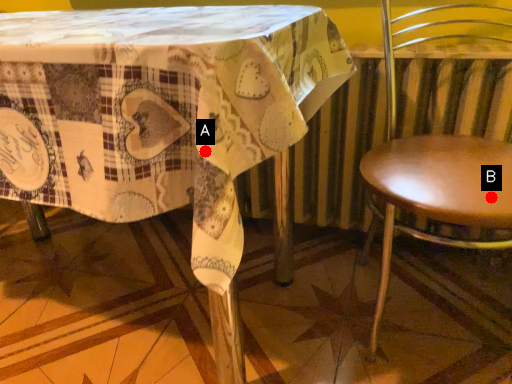
Question: Two points are circled on the image, labeled by A and B beside each circle. Which point is closer to the camera?

Choices:
 (A) A is closer
 (B) B is closer

Answer: (A)